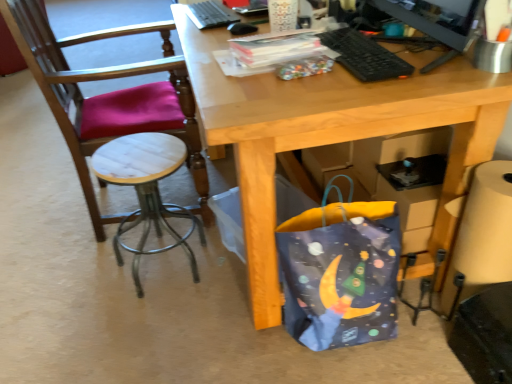
Where is `vacant space to the left of white marble stool at left`? vacant space to the left of white marble stool at left is located at coordinates (71, 279).